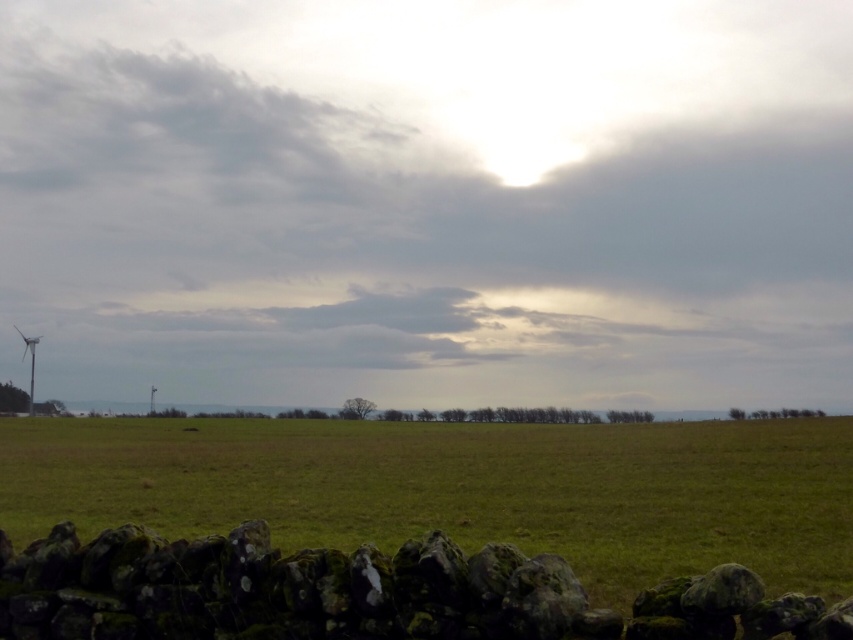
Question: Is green grassy field at lower center positioned behind white plastic wind turbine at lower left?

Choices:
 (A) no
 (B) yes

Answer: (A)

Question: From the image, what is the correct spatial relationship of cloudy sky at upper center in relation to white plastic wind turbine at lower left?

Choices:
 (A) left
 (B) right

Answer: (B)

Question: Which of these objects is positioned closest to the mossy stone wall at lower center?

Choices:
 (A) white plastic wind turbine at lower left
 (B) green grassy field at lower center
 (C) cloudy sky at upper center

Answer: (B)

Question: Which of the following is the closest to the observer?

Choices:
 (A) (132, 467)
 (B) (500, 572)

Answer: (B)

Question: Which point is farther to the camera?

Choices:
 (A) green grassy field at lower center
 (B) mossy stone wall at lower center
 (C) cloudy sky at upper center

Answer: (C)

Question: Can you confirm if cloudy sky at upper center is thinner than white plastic wind turbine at lower left?

Choices:
 (A) yes
 (B) no

Answer: (B)